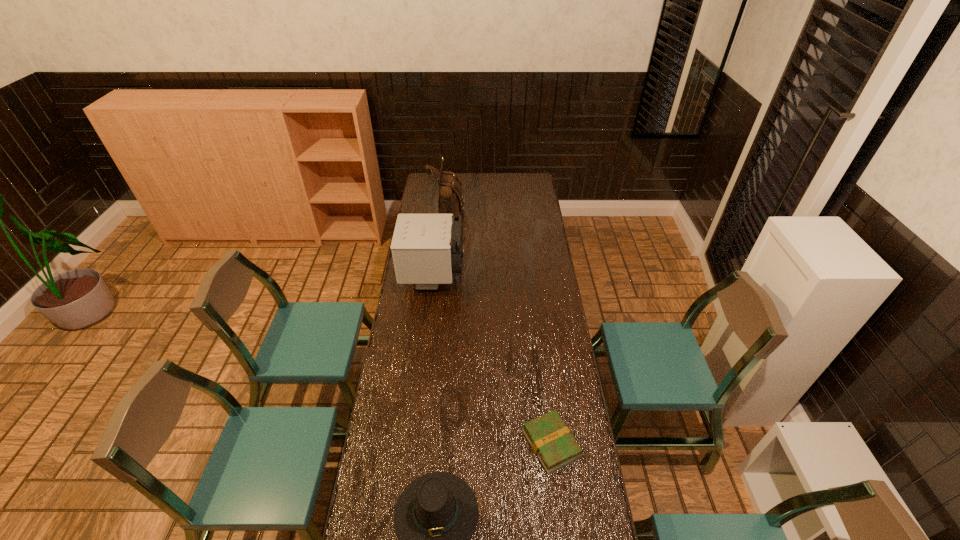
This screenshot has height=540, width=960. Identify the location of free space that satisfies the following two spatial constraints: 1. on the front-facing side of the farthest object; 2. on the left side of the rightmost object. click(427, 443).

This screenshot has height=540, width=960. In order to click on vacant space that satisfies the following two spatial constraints: 1. on the front-facing side of the shortest object; 2. on the right side of the shoulder bag in this screenshot , I will do `click(427, 443)`.

At what (x,y) coordinates should I click in order to perform the action: click on vacant area in the image that satisfies the following two spatial constraints: 1. on the front-facing side of the shoulder bag; 2. on the front side of the third nearest object. Please return your answer as a coordinate pair (x, y). Image resolution: width=960 pixels, height=540 pixels. Looking at the image, I should click on (442, 280).